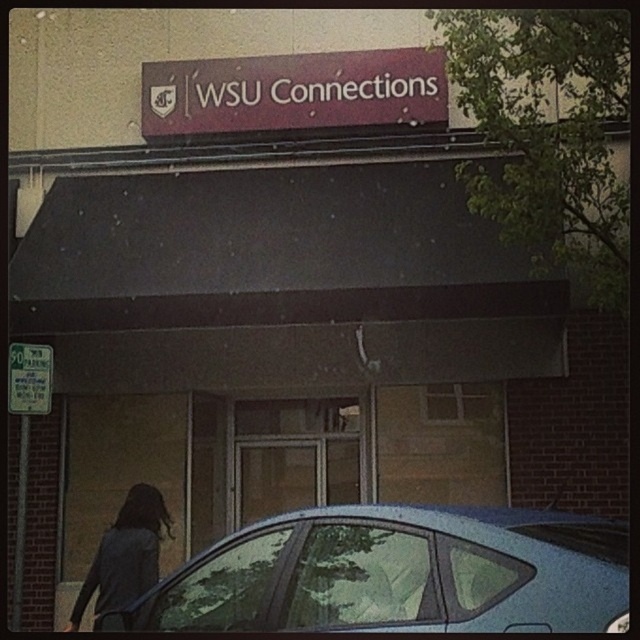
Question: Can you confirm if dark gray sweater at lower left is positioned below green paper sign at left?

Choices:
 (A) yes
 (B) no

Answer: (A)

Question: Can you confirm if dark gray sweater at lower left is bigger than green paper sign at left?

Choices:
 (A) yes
 (B) no

Answer: (A)

Question: Does matte maroon sign at upper center lie behind dark gray sweater at lower left?

Choices:
 (A) yes
 (B) no

Answer: (A)

Question: Among these objects, which one is farthest from the camera?

Choices:
 (A) dark gray sweater at lower left
 (B) metallic silver car at lower center
 (C) matte maroon sign at upper center
 (D) green paper sign at left

Answer: (C)

Question: Among these points, which one is farthest from the camera?

Choices:
 (A) (314, 72)
 (B) (611, 518)
 (C) (12, 390)

Answer: (A)

Question: Which point is farther to the camera?

Choices:
 (A) (147, 576)
 (B) (35, 346)
 (C) (404, 48)

Answer: (C)